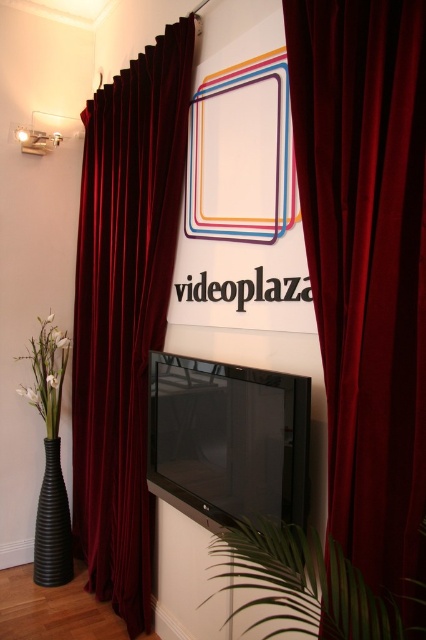
Is velvet dark red curtain at left above green leafy plant at lower center?

Correct, velvet dark red curtain at left is located above green leafy plant at lower center.

Which of these two, velvet dark red curtain at left or green leafy plant at lower center, stands taller?

velvet dark red curtain at left is taller.

Does point (83, 337) lie in front of point (363, 618)?

No, it is not.

This screenshot has height=640, width=426. What are the coordinates of `velvet dark red curtain at left` in the screenshot? It's located at (124, 308).

Is velvet dark red curtain at center above green leafy plant at lower center?

Correct, velvet dark red curtain at center is located above green leafy plant at lower center.

Is velvet dark red curtain at center in front of green leafy plant at lower center?

No, velvet dark red curtain at center is behind green leafy plant at lower center.

Is point (299, 134) positioned before point (345, 593)?

No, (299, 134) is further to viewer.

What are the coordinates of `velvet dark red curtain at center` in the screenshot? It's located at (367, 268).

Which of these two, velvet dark red curtain at left or black ribbed vase at lower left, stands taller?

velvet dark red curtain at left is taller.

Which is more to the left, velvet dark red curtain at left or black ribbed vase at lower left?

Positioned to the left is black ribbed vase at lower left.

At what (x,y) coordinates should I click in order to perform the action: click on velvet dark red curtain at left. Please return your answer as a coordinate pair (x, y). The height and width of the screenshot is (640, 426). Looking at the image, I should click on (124, 308).

Identify the location of velvet dark red curtain at left. (124, 308).